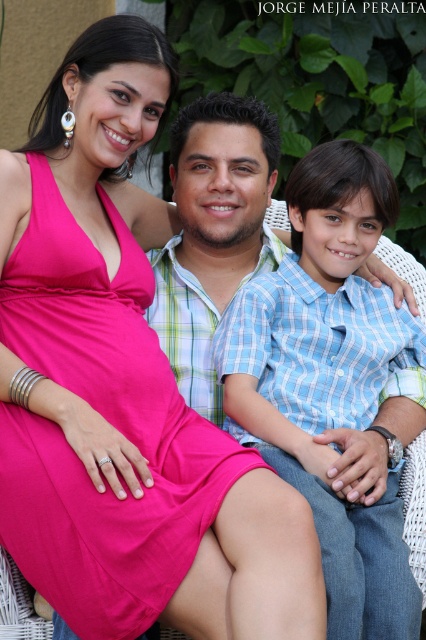
Question: Is matte pink dress at center above blue plaid shirt at center?

Choices:
 (A) yes
 (B) no

Answer: (A)

Question: Can you confirm if matte pink dress at center is thinner than blue plaid shirt at center?

Choices:
 (A) no
 (B) yes

Answer: (A)

Question: Which of the following is the closest to the observer?

Choices:
 (A) (218, 499)
 (B) (391, 605)

Answer: (B)

Question: Among these points, which one is farthest from the camera?

Choices:
 (A) (282, 275)
 (B) (54, 547)

Answer: (A)

Question: Is matte pink dress at center below blue plaid shirt at center?

Choices:
 (A) no
 (B) yes

Answer: (A)